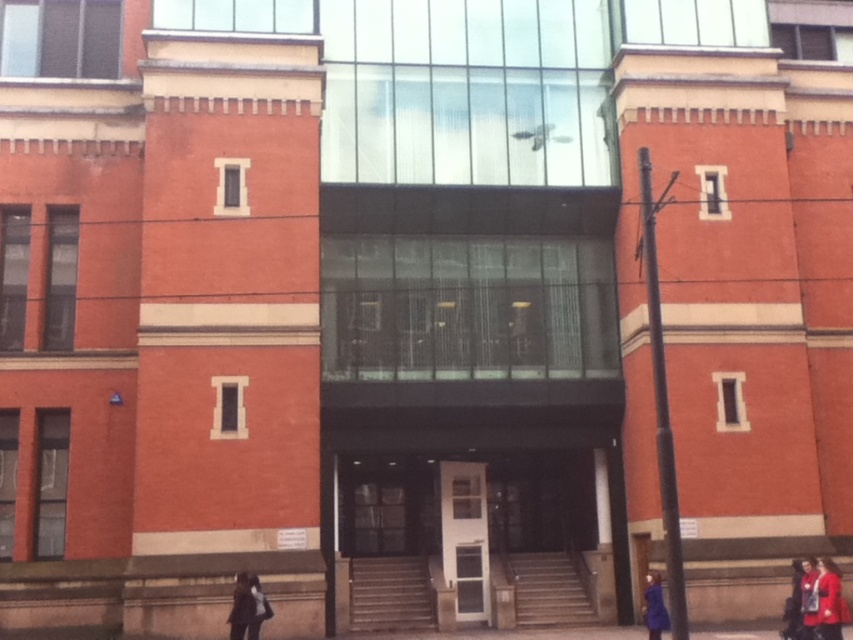
Question: Is dark brown leather coat at lower left bigger than red fabric coat at lower right?

Choices:
 (A) no
 (B) yes

Answer: (B)

Question: Which point appears closest to the camera in this image?

Choices:
 (A) (254, 611)
 (B) (796, 605)
 (C) (648, 598)
 (D) (268, 616)

Answer: (A)

Question: Which object appears closest to the camera in this image?

Choices:
 (A) dark brown leather coat at lower left
 (B) blue fabric coat at lower right
 (C) white glass door at center
 (D) matte red coat at lower right

Answer: (D)

Question: Is red wool coat at lower right bigger than dark gray fabric jacket at lower left?

Choices:
 (A) yes
 (B) no

Answer: (B)

Question: Based on their relative distances, which object is farther from the red fabric coat at lower right?

Choices:
 (A) dark brown leather coat at lower left
 (B) blue fabric coat at lower right
 (C) dark gray fabric jacket at lower left

Answer: (A)

Question: Is red fabric coat at lower right to the left of blue fabric coat at lower right from the viewer's perspective?

Choices:
 (A) no
 (B) yes

Answer: (A)